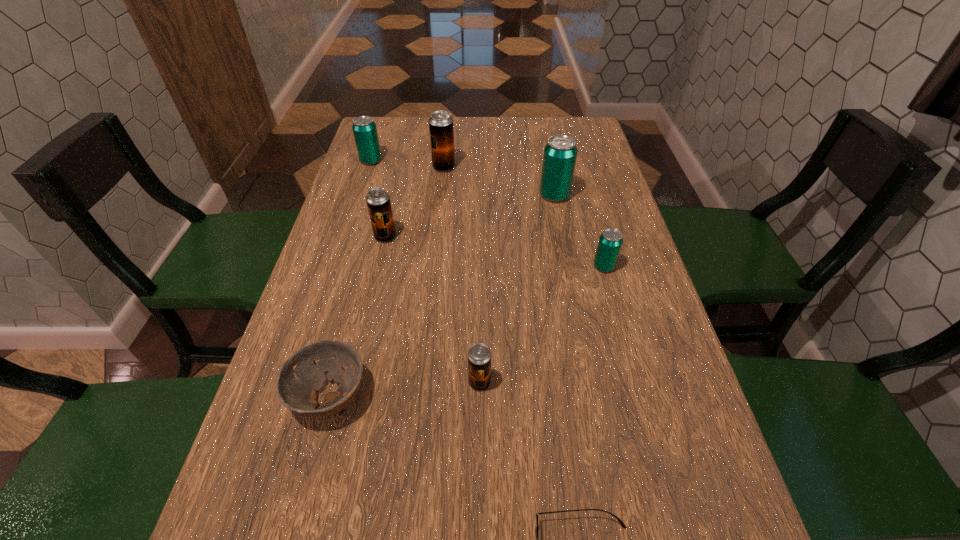
Image resolution: width=960 pixels, height=540 pixels. I want to click on vacant space located on the right of the brown bowl, so click(x=396, y=395).

Where is `bowl at the left edge`? bowl at the left edge is located at coordinates (301, 376).

In the image, there is a desktop. Identify the location of free space at the far edge. (505, 124).

In order to click on free space at the left edge of the desktop in this screenshot , I will do `click(365, 197)`.

At what (x,y) coordinates should I click in order to perform the action: click on vacant position at the right edge of the desktop. Please return your answer as a coordinate pair (x, y). The height and width of the screenshot is (540, 960). Looking at the image, I should click on (580, 170).

Where is `free space at the far left corner of the desktop`? This screenshot has height=540, width=960. free space at the far left corner of the desktop is located at coordinates (397, 142).

At what (x,y) coordinates should I click in order to perform the action: click on free point at the far right corner. Please return your answer as a coordinate pair (x, y). Looking at the image, I should click on (594, 150).

Where is `free space between the bowl and the farthest teal beer can`? Image resolution: width=960 pixels, height=540 pixels. free space between the bowl and the farthest teal beer can is located at coordinates (350, 278).

I want to click on free area in between the rightmost beer can and the second farthest black beer can, so click(x=494, y=252).

I want to click on vacant space that's between the rightmost black beer can and the third nearest beer can, so click(432, 309).